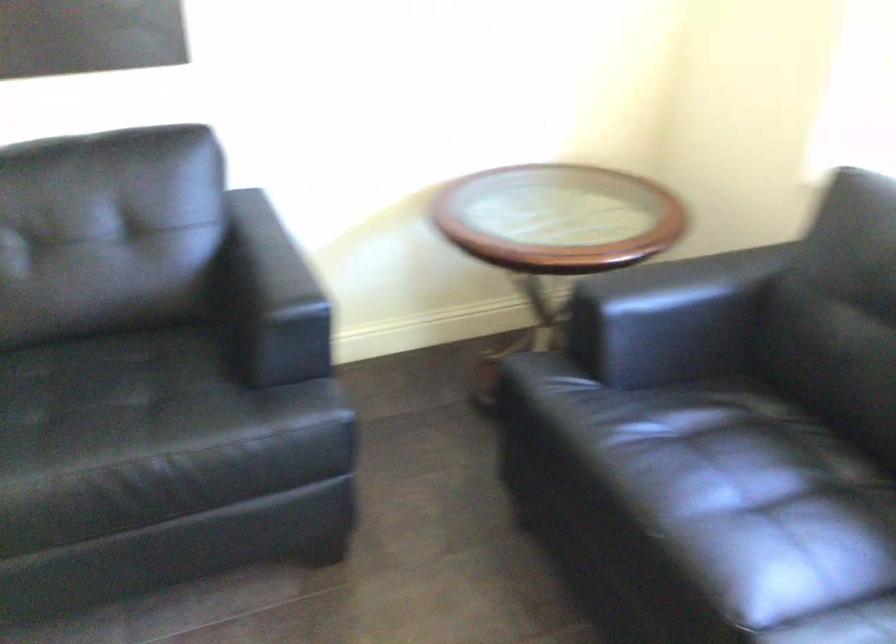
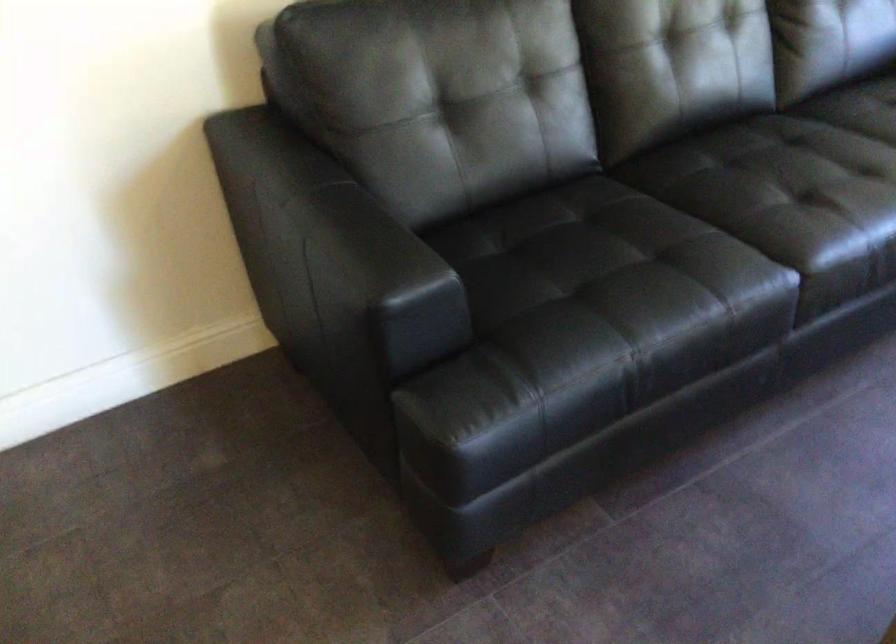
Question: What movement of the cameraman would produce the second image?

Choices:
 (A) Left
 (B) Right
 (C) Forward
 (D) Backward

Answer: (A)